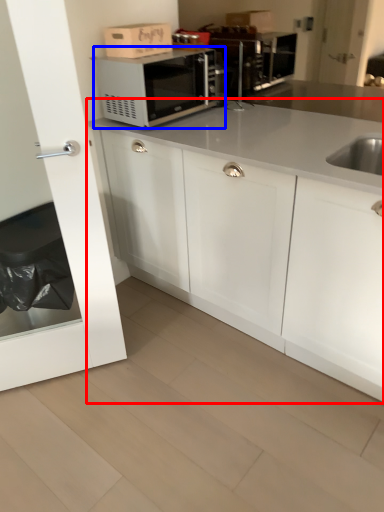
Question: Among these objects, which one is nearest to the camera, cabinetry (highlighted by a red box) or microwave oven (highlighted by a blue box)?

Choices:
 (A) cabinetry
 (B) microwave oven

Answer: (A)